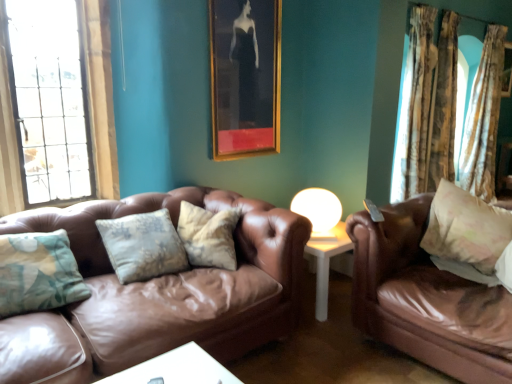
Question: Are textured beige curtain at right, which appears as the third curtain when viewed from the right, and fluffy beige pillow at right making contact?

Choices:
 (A) yes
 (B) no

Answer: (B)

Question: Is textured beige curtain at right, which appears as the third curtain when viewed from the right, outside of fluffy beige pillow at right?

Choices:
 (A) no
 (B) yes

Answer: (B)

Question: From the image's perspective, would you say textured beige curtain at right, which appears as the third curtain when viewed from the right, is positioned over fluffy beige pillow at right?

Choices:
 (A) yes
 (B) no

Answer: (A)

Question: Does textured beige curtain at right, which appears as the third curtain when viewed from the right, lie behind fluffy beige pillow at right?

Choices:
 (A) no
 (B) yes

Answer: (B)

Question: Can you confirm if textured beige curtain at right, which appears as the third curtain when viewed from the right, is positioned to the left of fluffy beige pillow at right?

Choices:
 (A) yes
 (B) no

Answer: (B)

Question: Is fluffy beige pillow at right taller or shorter than floral fabric curtain at right, which ranks as the 2th curtain in left-to-right order?

Choices:
 (A) tall
 (B) short

Answer: (B)

Question: In the image, is fluffy beige pillow at right on the left side or the right side of floral fabric curtain at right, which is counted as the second curtain, starting from the right?

Choices:
 (A) right
 (B) left

Answer: (B)

Question: Looking at their shapes, would you say fluffy beige pillow at right is wider or thinner than floral fabric curtain at right, which is counted as the second curtain, starting from the right?

Choices:
 (A) thin
 (B) wide

Answer: (B)

Question: Does point (449, 195) appear closer or farther from the camera than point (416, 21)?

Choices:
 (A) farther
 (B) closer

Answer: (B)

Question: Is fluffy beige pillow at right bigger or smaller than gold-framed picture at upper center, which is the 1th picture frame from front to back?

Choices:
 (A) small
 (B) big

Answer: (B)

Question: In the image, is fluffy beige pillow at right on the left side or the right side of gold-framed picture at upper center, which appears as the first picture frame when ordered from the bottom?

Choices:
 (A) left
 (B) right

Answer: (B)

Question: Does point [x=478, y=261] appear closer or farther from the camera than point [x=262, y=66]?

Choices:
 (A) closer
 (B) farther

Answer: (A)

Question: From the image's perspective, is fluffy beige pillow at right above or below gold-framed picture at upper center, which is the second picture frame in right-to-left order?

Choices:
 (A) above
 (B) below

Answer: (B)

Question: Is white glossy table lamp at center spatially inside fluffy beige pillow at right, or outside of it?

Choices:
 (A) inside
 (B) outside

Answer: (B)

Question: Considering their positions, is white glossy table lamp at center located in front of or behind fluffy beige pillow at right?

Choices:
 (A) behind
 (B) front

Answer: (A)